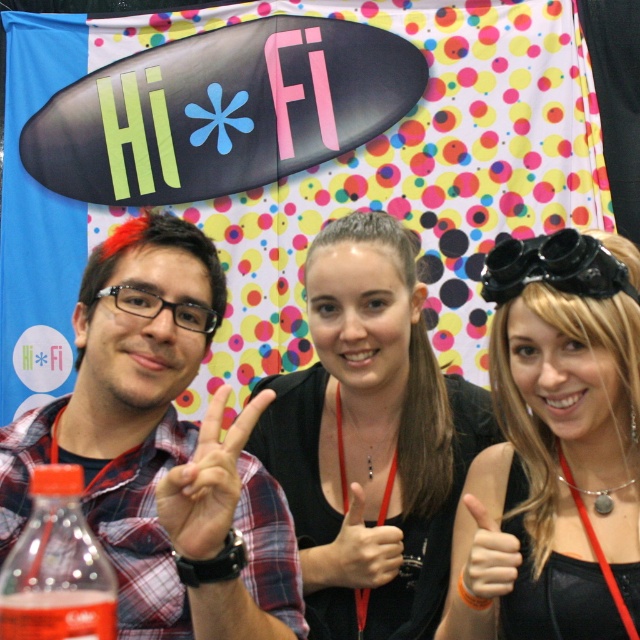
Question: Can you confirm if black fabric at center is positioned above matte plaid shirt at center left?

Choices:
 (A) yes
 (B) no

Answer: (A)

Question: Can you confirm if black matte goggles at upper center is positioned to the left of black fabric at center?

Choices:
 (A) no
 (B) yes

Answer: (A)

Question: Which object appears farthest from the camera in this image?

Choices:
 (A) plaid shirt at center
 (B) smooth skin hand at center

Answer: (B)

Question: Which point is closer to the camera?

Choices:
 (A) (474, 508)
 (B) (369, 394)
 (C) (220, 509)
 (D) (522, 467)

Answer: (C)

Question: Which object is positioned farthest from the matte plaid shirt at center left?

Choices:
 (A) smooth skin hand at center
 (B) black fabric at center
 (C) plaid shirt at center

Answer: (B)

Question: Can you confirm if plaid shirt at center is bigger than smooth skin hand at center?

Choices:
 (A) no
 (B) yes

Answer: (B)